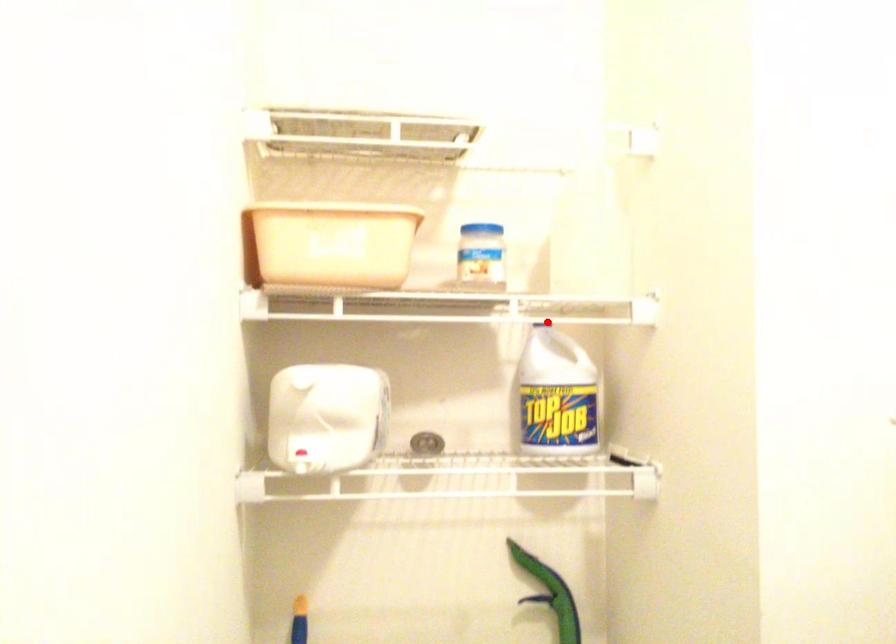
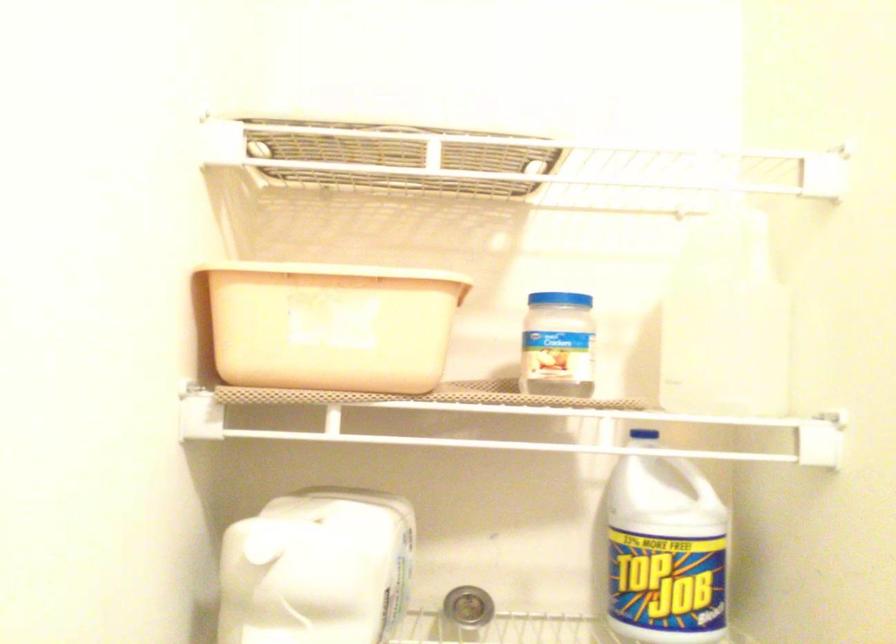
Question: A red point is marked in image1. In image2, is the corresponding 3D point closer to the camera or farther? Reply with the corresponding letter.

Choices:
 (A) The corresponding 3D point is closer.
 (B) The corresponding 3D point is farther.

Answer: (A)